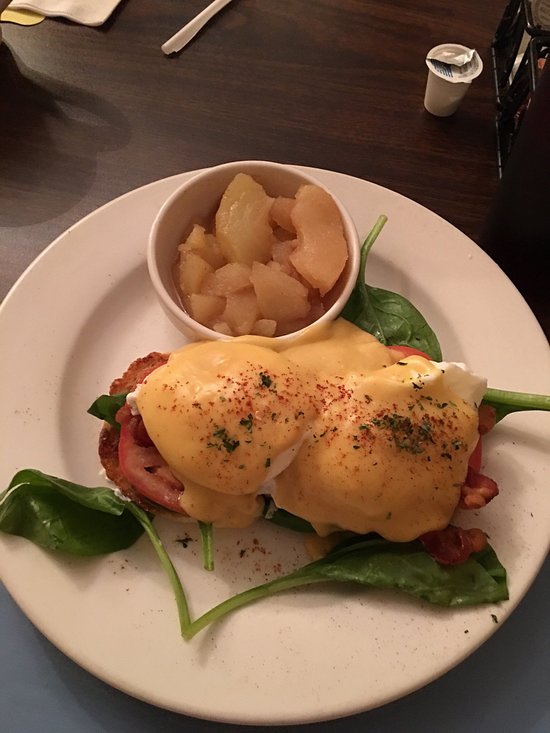
The height and width of the screenshot is (733, 550). I want to click on plate, so click(x=493, y=320).